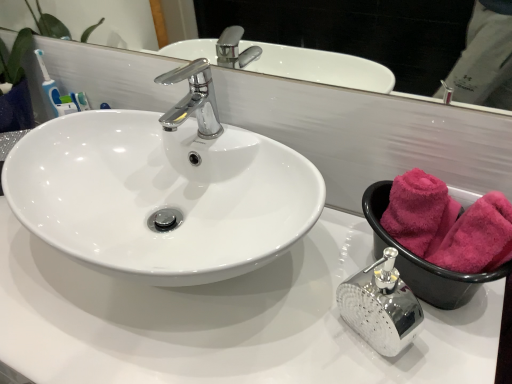
Image resolution: width=512 pixels, height=384 pixels. I want to click on blank area to the left of pink fluffy towel at right, arranged as the 1th bath towel when viewed from the back, so click(x=316, y=275).